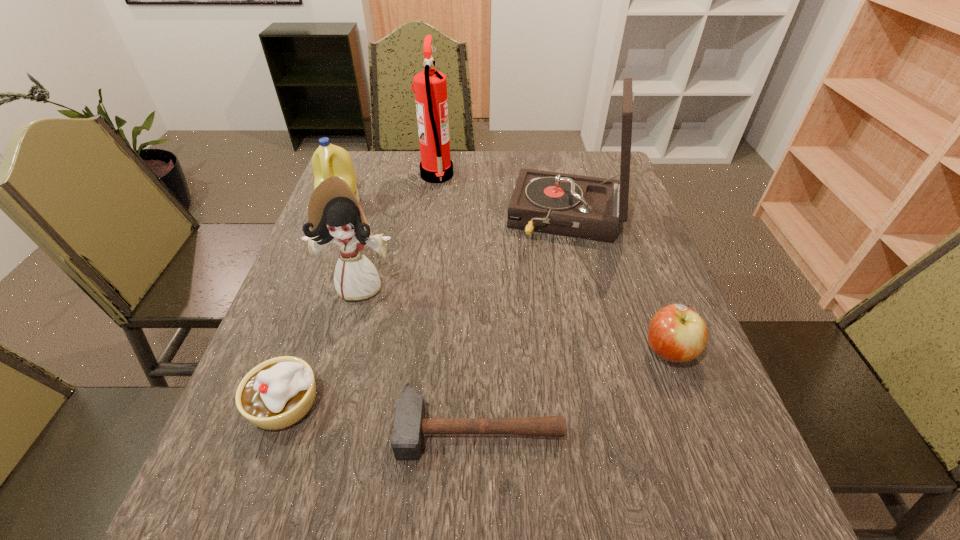
Image resolution: width=960 pixels, height=540 pixels. In order to click on apple situated at the right edge in this screenshot , I will do `click(676, 333)`.

Identify the location of object that is at the far right corner. This screenshot has height=540, width=960. (585, 207).

This screenshot has width=960, height=540. Find the location of `vacant space at the far edge of the desktop`. vacant space at the far edge of the desktop is located at coordinates (565, 167).

Locate an element on the screen. This screenshot has height=540, width=960. vacant region at the near edge of the desktop is located at coordinates (594, 519).

Locate an element on the screen. The height and width of the screenshot is (540, 960). free space at the left edge is located at coordinates (324, 259).

In the image, there is a desktop. Identify the location of vacant area at the right edge. (657, 275).

The image size is (960, 540). I want to click on vacant space at the far left corner of the desktop, so click(x=379, y=157).

The image size is (960, 540). What are the coordinates of `empty location between the fourth tallest object and the apple` in the screenshot? It's located at (505, 279).

This screenshot has width=960, height=540. I want to click on free point between the phonograph record and the whipped cream, so click(426, 310).

The height and width of the screenshot is (540, 960). What are the coordinates of `free space between the apple and the fourth tallest object` in the screenshot? It's located at (505, 279).